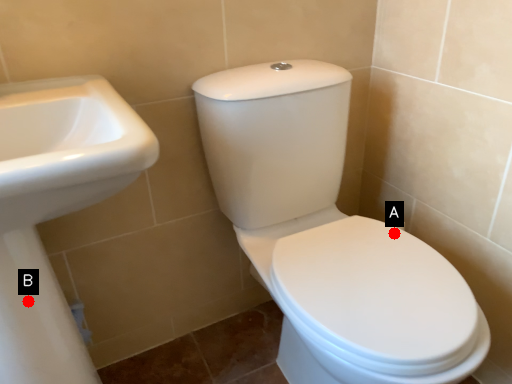
Question: Two points are circled on the image, labeled by A and B beside each circle. Among these points, which one is farthest from the camera?

Choices:
 (A) A is further
 (B) B is further

Answer: (A)